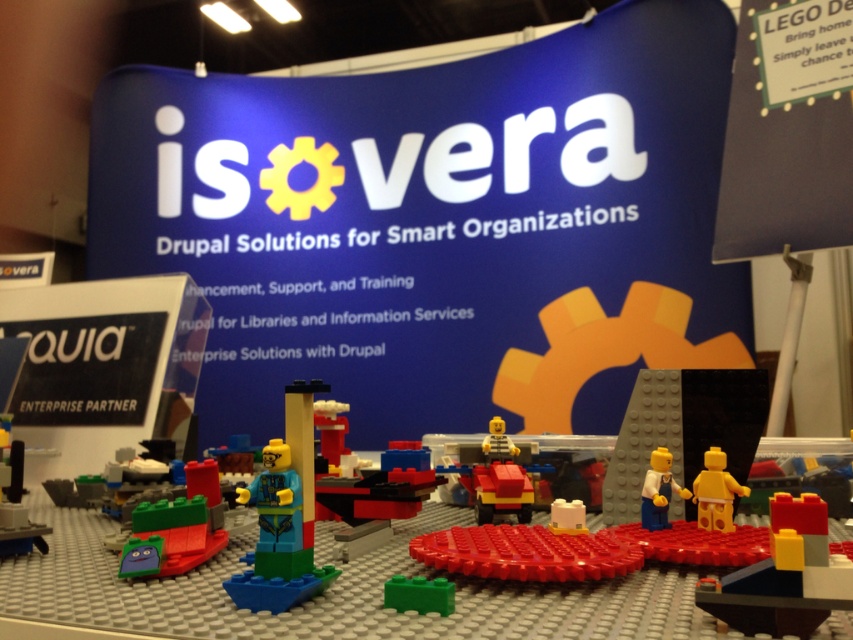
Question: Observing the image, what is the correct spatial positioning of brick red plastic toy at center in reference to green plastic brick at center?

Choices:
 (A) below
 (B) above

Answer: (B)

Question: Does green matte toy at lower left have a greater width compared to yellow plastic minifigure at center?

Choices:
 (A) yes
 (B) no

Answer: (A)

Question: Estimate the real-world distances between objects in this image. Which object is closer to the bright yellow plastic minifigure at center?

Choices:
 (A) blue plastic minifigure at center
 (B) white plastic minifigure at center

Answer: (B)

Question: Does green matte toy at lower left appear on the right side of white plastic minifigure at center?

Choices:
 (A) yes
 (B) no

Answer: (B)

Question: Which point appears closest to the camera in this image?

Choices:
 (A) (825, 540)
 (B) (724, 515)
 (C) (178, 513)

Answer: (A)

Question: Considering the real-world distances, which object is farthest from the blue plastic minifigure at center?

Choices:
 (A) yellow plastic minifigure at center
 (B) brick red plastic toy at center
 (C) bright yellow plastic minifigure at center

Answer: (C)